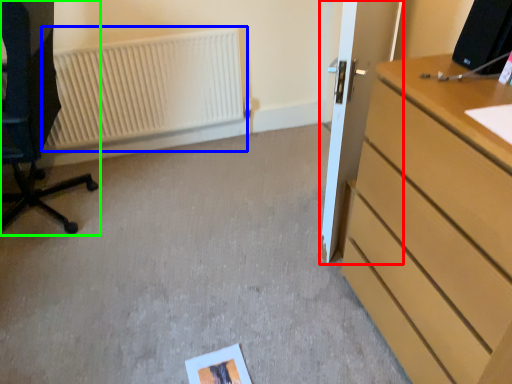
Question: Which object is the farthest from door (highlighted by a red box)? Choose among these: radiator (highlighted by a blue box) or furniture (highlighted by a green box).

Choices:
 (A) radiator
 (B) furniture

Answer: (B)